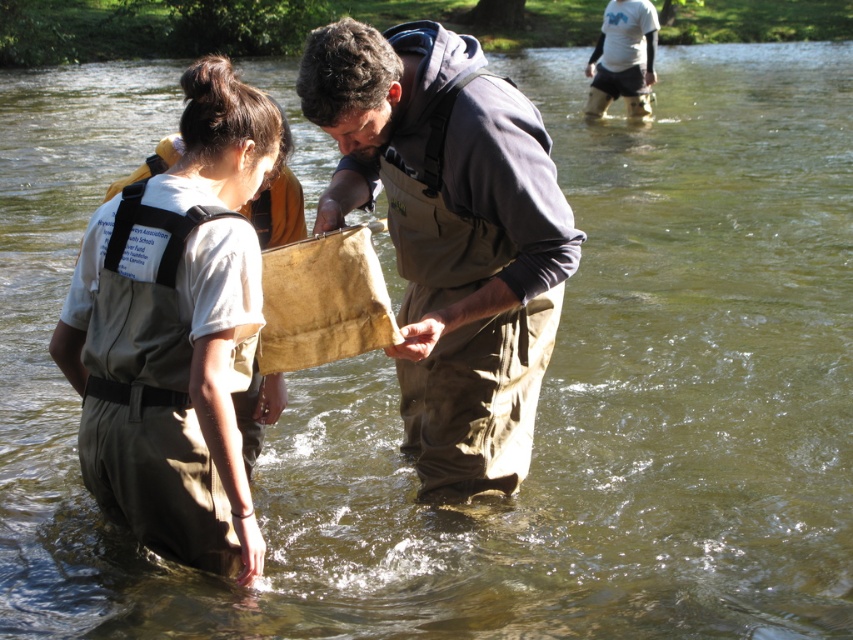
You are a park ranger who needs to retrieve an item from the water. You have a brown canvas bag at center and khaki fabric waders at left. Can you reach the bag from the waders without moving your feet?

The brown canvas bag at center and khaki fabric waders at left are 32.19 inches apart from each other. Since 32.19 inches is approximately 2.68 feet, and assuming an average arm reach of about 2 feet, you would need to move your feet to reach the bag.